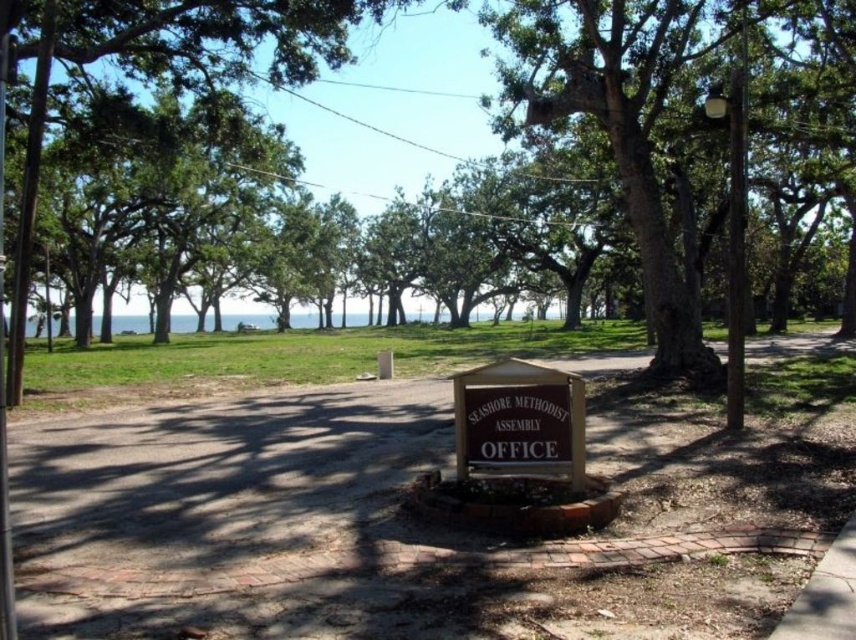
You are a visitor at the SEASHORE METHODIST ASSEMBLY and want to find the office. You see the brown brick pavement at center and the brown wooden sign at center. According to the scene, which object is located to the right of the other?

The brown brick pavement at center is to the right of brown wooden sign at center.

You are standing at the point with coordinates point (x=373, y=609) and want to walk towards the point (x=464, y=476). Based on the scene description, will you be walking towards or away from the sign mounted on a wooden post at the center of the landscaped area?

Point (x=373, y=609) is in front of point (x=464, y=476), so walking towards point (x=464, y=476) means you are moving away from the sign mounted on a wooden post at the center of the landscaped area.